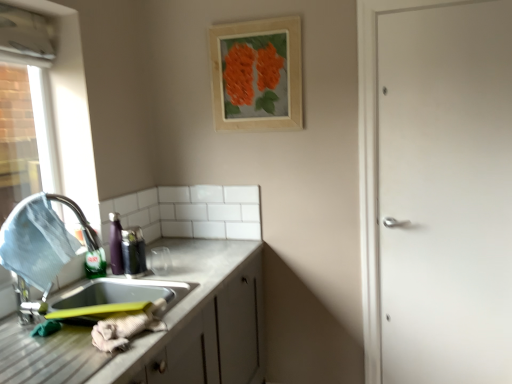
Question: Can you confirm if metallic stainless steel sink at left is taller than wooden frame at upper center?

Choices:
 (A) yes
 (B) no

Answer: (B)

Question: Is wooden frame at upper center completely or partially inside metallic stainless steel sink at left?

Choices:
 (A) no
 (B) yes

Answer: (A)

Question: From the image's perspective, would you say metallic stainless steel sink at left is shown under wooden frame at upper center?

Choices:
 (A) no
 (B) yes

Answer: (B)

Question: From a real-world perspective, is metallic stainless steel sink at left on top of wooden frame at upper center?

Choices:
 (A) no
 (B) yes

Answer: (A)

Question: Can you confirm if metallic stainless steel sink at left is positioned to the right of wooden frame at upper center?

Choices:
 (A) yes
 (B) no

Answer: (B)

Question: Is metallic stainless steel sink at left far from wooden frame at upper center?

Choices:
 (A) no
 (B) yes

Answer: (B)

Question: From the image's perspective, is metallic stainless steel sink at lower left located beneath wooden frame at upper center?

Choices:
 (A) no
 (B) yes

Answer: (B)

Question: Is metallic stainless steel sink at lower left positioned far away from wooden frame at upper center?

Choices:
 (A) yes
 (B) no

Answer: (B)

Question: Can you confirm if metallic stainless steel sink at lower left is bigger than wooden frame at upper center?

Choices:
 (A) yes
 (B) no

Answer: (A)

Question: Can you confirm if metallic stainless steel sink at lower left is shorter than wooden frame at upper center?

Choices:
 (A) yes
 (B) no

Answer: (A)

Question: Considering the relative sizes of metallic stainless steel sink at lower left and wooden frame at upper center in the image provided, is metallic stainless steel sink at lower left smaller than wooden frame at upper center?

Choices:
 (A) no
 (B) yes

Answer: (A)

Question: Does metallic stainless steel sink at lower left have a greater height compared to wooden frame at upper center?

Choices:
 (A) no
 (B) yes

Answer: (A)

Question: Does white matte door at right have a smaller size compared to metallic stainless steel sink at lower left?

Choices:
 (A) no
 (B) yes

Answer: (A)